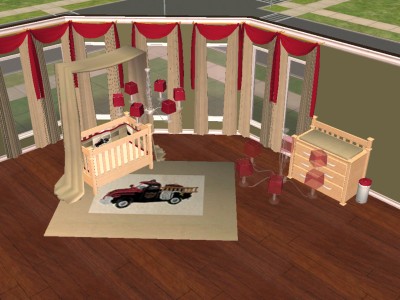
Image resolution: width=400 pixels, height=300 pixels. I want to click on changing pad, so click(346, 150).